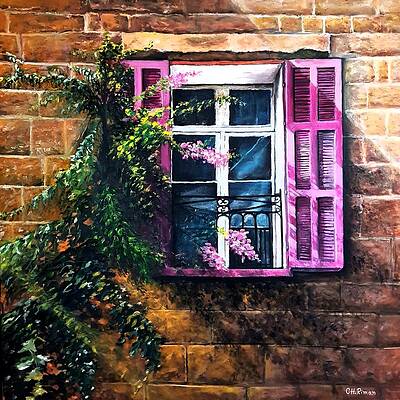
Locate an element on the screen. window panes is located at coordinates (245, 114), (239, 163), (242, 190), (198, 190), (190, 162), (200, 116).